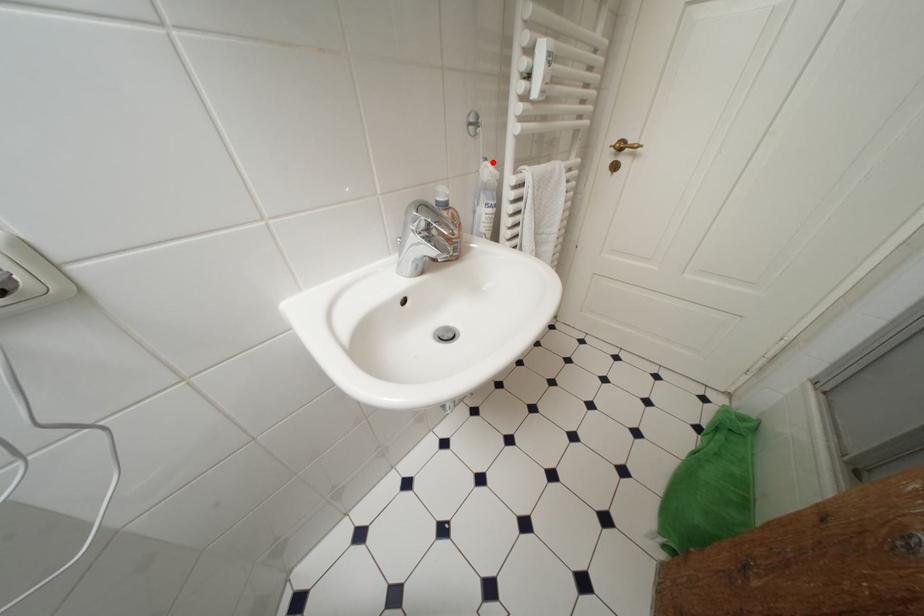
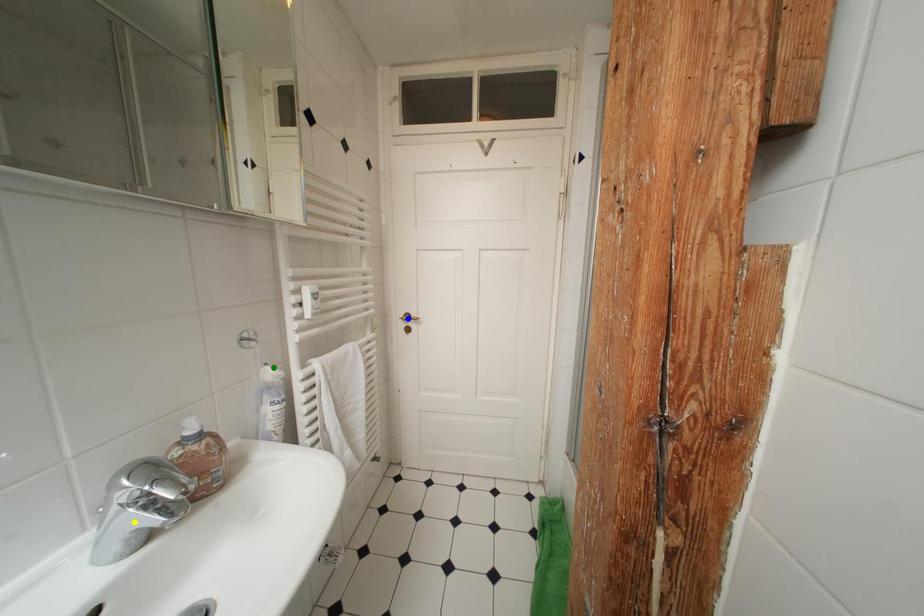
Question: I am providing you with two images of the same scene from different viewpoints. A red point is marked on the first image. You are given multiple points on the second image. Can you choose the point in image 2 that corresponds to the point in image 1?

Choices:
 (A) green point
 (B) yellow point
 (C) blue point

Answer: (A)